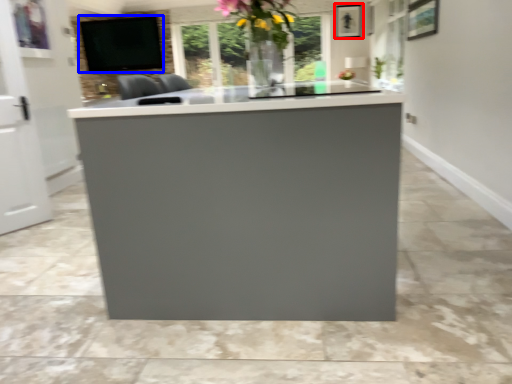
Question: Which object is closer to the camera taking this photo, picture frame (highlighted by a red box) or window screen (highlighted by a blue box)?

Choices:
 (A) picture frame
 (B) window screen

Answer: (A)